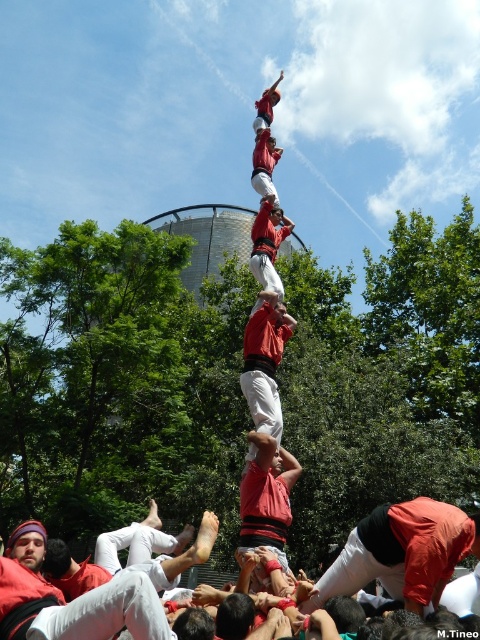
You are a photographer positioned at the center of the scene. You want to capture a photo of the human tower and ensure the red fabric man at lower right is visible in the frame. Based on his coordinates, is he positioned to the left or right of the center?

The red fabric man at lower right is located at point 0.864 on the x and y axis, meaning he is positioned to the right of the center since the coordinates are higher than 0.5.

You are a photographer standing at the base of the human tower. You want to take a photo that includes both the red fabric shirt at center and the matte red shirt at center. Given that your camera has a maximum focus range of 3 meters, will you be able to capture both shirts in focus?

The red fabric shirt at center and matte red shirt at center are 3.68 meters apart, which exceeds the camera maximum focus range of 3 meters. Therefore, you cannot capture both shirts in focus.